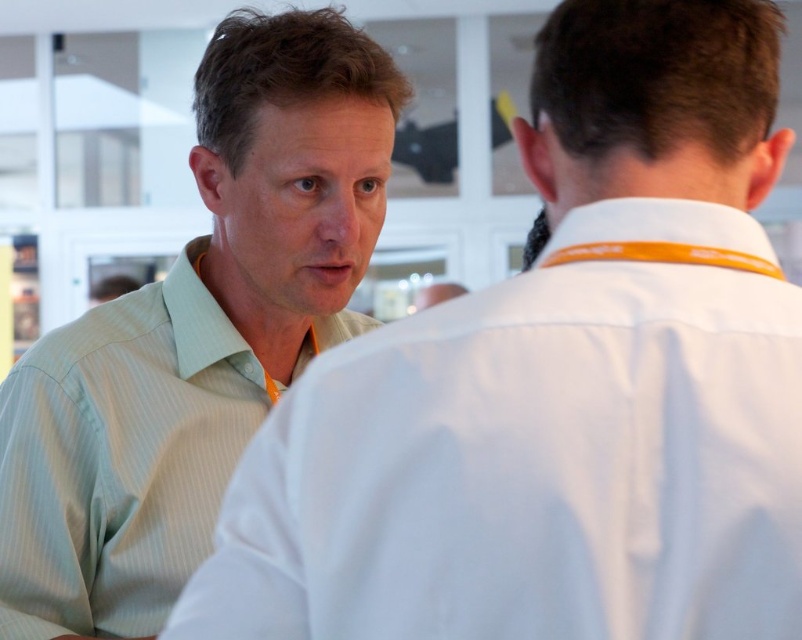
Is light green striped shirt at left thinner than orange fabric neckband at upper center?

No.

This screenshot has width=802, height=640. In order to click on light green striped shirt at left in this screenshot , I will do `click(196, 333)`.